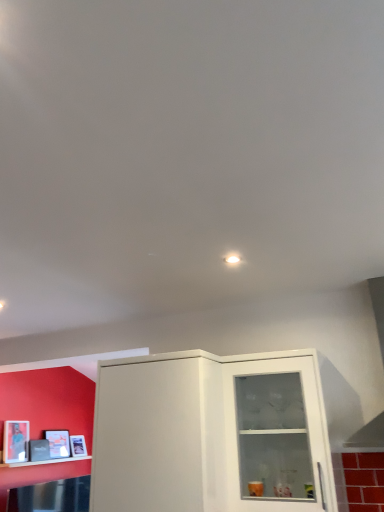
Question: From a real-world perspective, is white glossy shelf at lower left under transparent glass cabinet at center?

Choices:
 (A) no
 (B) yes

Answer: (B)

Question: Is white glossy shelf at lower left at the left side of transparent glass cabinet at center?

Choices:
 (A) yes
 (B) no

Answer: (A)

Question: Is white glossy shelf at lower left in contact with transparent glass cabinet at center?

Choices:
 (A) yes
 (B) no

Answer: (B)

Question: From the image's perspective, is white glossy shelf at lower left under transparent glass cabinet at center?

Choices:
 (A) yes
 (B) no

Answer: (A)

Question: Considering the relative sizes of white glossy shelf at lower left and transparent glass cabinet at center in the image provided, is white glossy shelf at lower left taller than transparent glass cabinet at center?

Choices:
 (A) no
 (B) yes

Answer: (A)

Question: Is transparent glass cabinet at center in front of or behind matte white cabinet at center in the image?

Choices:
 (A) behind
 (B) front

Answer: (A)

Question: In terms of size, does transparent glass cabinet at center appear bigger or smaller than matte white cabinet at center?

Choices:
 (A) small
 (B) big

Answer: (A)

Question: Does point (278, 433) appear closer or farther from the camera than point (203, 417)?

Choices:
 (A) closer
 (B) farther

Answer: (B)

Question: Would you say transparent glass cabinet at center is to the left or to the right of matte white cabinet at center in the picture?

Choices:
 (A) right
 (B) left

Answer: (A)

Question: Considering the positions of point (271, 503) and point (13, 462), is point (271, 503) closer or farther from the camera than point (13, 462)?

Choices:
 (A) farther
 (B) closer

Answer: (B)

Question: From a real-world perspective, is transparent glass cabinet at center above or below white glossy shelf at lower left?

Choices:
 (A) below
 (B) above

Answer: (B)

Question: Relative to white glossy shelf at lower left, is transparent glass cabinet at center in front or behind?

Choices:
 (A) behind
 (B) front

Answer: (B)

Question: Considering the positions of transparent glass cabinet at center and white glossy shelf at lower left in the image, is transparent glass cabinet at center bigger or smaller than white glossy shelf at lower left?

Choices:
 (A) big
 (B) small

Answer: (A)

Question: Considering the positions of point (114, 416) and point (264, 358), is point (114, 416) closer or farther from the camera than point (264, 358)?

Choices:
 (A) farther
 (B) closer

Answer: (B)

Question: Is matte white cabinet at center to the left or to the right of transparent glass cabinet at center in the image?

Choices:
 (A) left
 (B) right

Answer: (A)